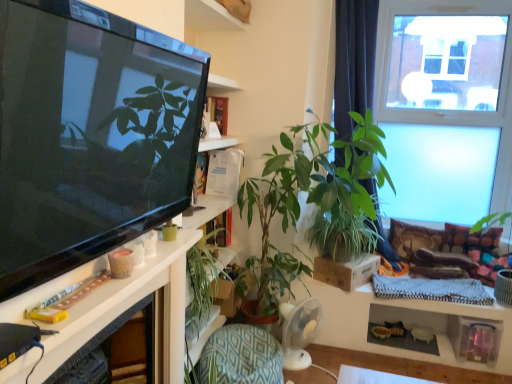
Question: Which direction should I rotate to look at green leafy plant at center, placed as the second houseplant when sorted from left to right, — up or down?

Choices:
 (A) down
 (B) up

Answer: (A)

Question: Is green leafy plant at center, placed as the second houseplant when sorted from left to right, bigger than green textured cushion at lower center?

Choices:
 (A) no
 (B) yes

Answer: (B)

Question: Does green leafy plant at center, which is the first houseplant in right-to-left order, have a lesser width compared to green textured cushion at lower center?

Choices:
 (A) yes
 (B) no

Answer: (B)

Question: From the image's perspective, would you say green leafy plant at center, which is the first houseplant in right-to-left order, is shown under green textured cushion at lower center?

Choices:
 (A) yes
 (B) no

Answer: (B)

Question: Is green leafy plant at center, placed as the second houseplant when sorted from left to right, oriented towards green textured cushion at lower center?

Choices:
 (A) no
 (B) yes

Answer: (B)

Question: Is green leafy plant at center, placed as the second houseplant when sorted from left to right, smaller than green textured cushion at lower center?

Choices:
 (A) no
 (B) yes

Answer: (A)

Question: Is green leafy plant at center, which is the first houseplant in right-to-left order, located outside green textured cushion at lower center?

Choices:
 (A) no
 (B) yes

Answer: (B)

Question: Does green textured cushion at lower center appear on the right side of white glossy shelf at left?

Choices:
 (A) yes
 (B) no

Answer: (A)

Question: Does green textured cushion at lower center turn towards white glossy shelf at left?

Choices:
 (A) yes
 (B) no

Answer: (B)

Question: Could white glossy shelf at left be considered to be inside green textured cushion at lower center?

Choices:
 (A) no
 (B) yes

Answer: (A)

Question: Are green textured cushion at lower center and white glossy shelf at left making contact?

Choices:
 (A) yes
 (B) no

Answer: (B)

Question: Can you confirm if green textured cushion at lower center is wider than white glossy shelf at left?

Choices:
 (A) no
 (B) yes

Answer: (B)

Question: Are green textured cushion at lower center and white glossy shelf at left located far from each other?

Choices:
 (A) no
 (B) yes

Answer: (A)

Question: Can you confirm if white glossy shelf at left is wider than green textured cushion at lower center?

Choices:
 (A) no
 (B) yes

Answer: (A)